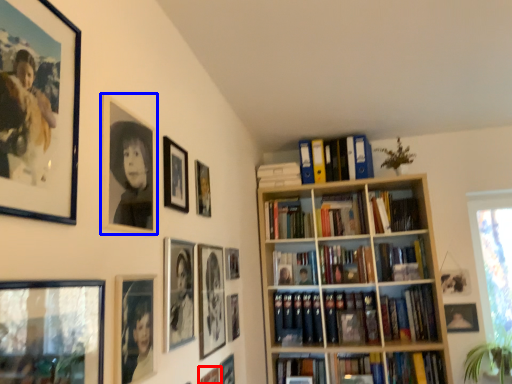
Question: Which of the following is the closest to the observer, picture frame (highlighted by a red box) or picture frame (highlighted by a blue box)?

Choices:
 (A) picture frame
 (B) picture frame

Answer: (B)